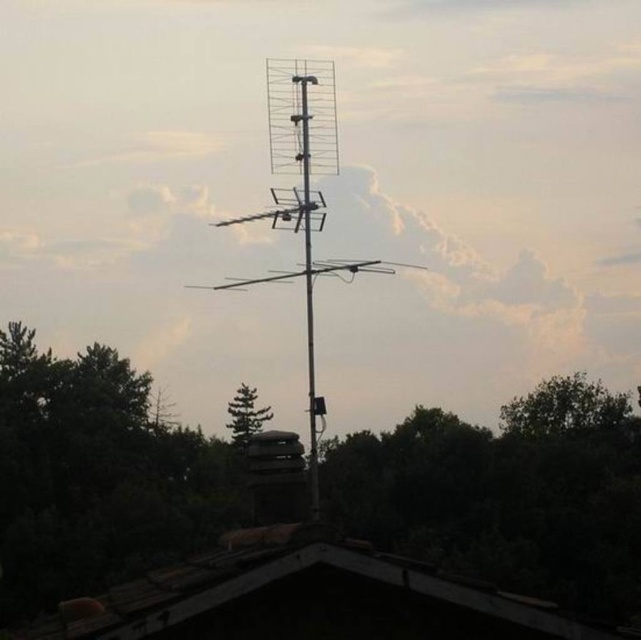
Question: Can you confirm if brown wooden roof at lower center is thinner than metallic antenna at center?

Choices:
 (A) yes
 (B) no

Answer: (A)

Question: Does green leafy tree at center have a greater width compared to metallic antenna at center?

Choices:
 (A) yes
 (B) no

Answer: (A)

Question: Estimate the real-world distances between objects in this image. Which object is farther from the green leafy tree at center?

Choices:
 (A) green matte tree at center
 (B) brown wooden roof at lower center

Answer: (B)

Question: From the image, what is the correct spatial relationship of brown wooden roof at lower center in relation to green matte tree at center?

Choices:
 (A) above
 (B) below

Answer: (A)

Question: Which of the following is the closest to the observer?

Choices:
 (A) (237, 410)
 (B) (103, 397)
 (C) (315, 129)

Answer: (B)

Question: Which of the following is the closest to the observer?

Choices:
 (A) metallic antenna at center
 (B) brown wooden roof at lower center
 (C) green leafy tree at center

Answer: (B)